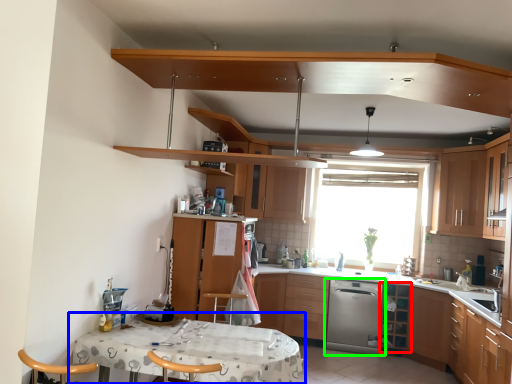
Question: Which object is the closest to the shelf (highlighted by a red box)? Choose among these: table (highlighted by a blue box) or kitchen appliance (highlighted by a green box).

Choices:
 (A) table
 (B) kitchen appliance

Answer: (B)